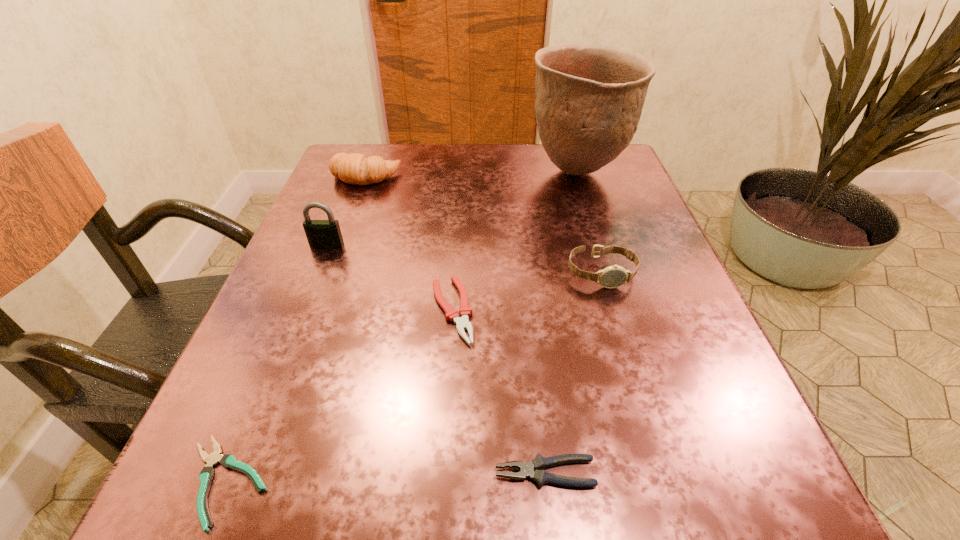
The width and height of the screenshot is (960, 540). Find the location of `vacant space that satisfies the following two spatial constraints: 1. on the face of the fourth shortest object; 2. at the gripping part of the rightmost pliers`. vacant space that satisfies the following two spatial constraints: 1. on the face of the fourth shortest object; 2. at the gripping part of the rightmost pliers is located at coordinates (660, 473).

The height and width of the screenshot is (540, 960). What are the coordinates of `vacant space that satisfies the following two spatial constraints: 1. on the back side of the tallest object; 2. on the left side of the crescent roll` in the screenshot? It's located at (367, 172).